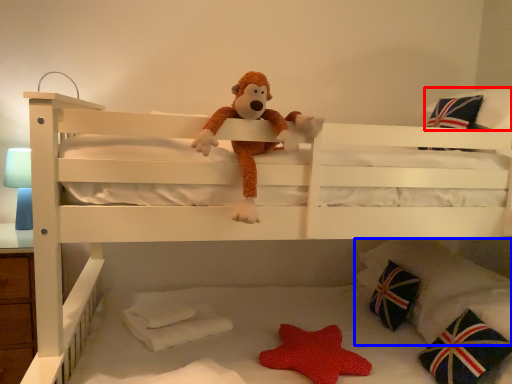
Question: Which of the following is the farthest to the observer, pillow (highlighted by a red box) or pillow (highlighted by a blue box)?

Choices:
 (A) pillow
 (B) pillow

Answer: (B)